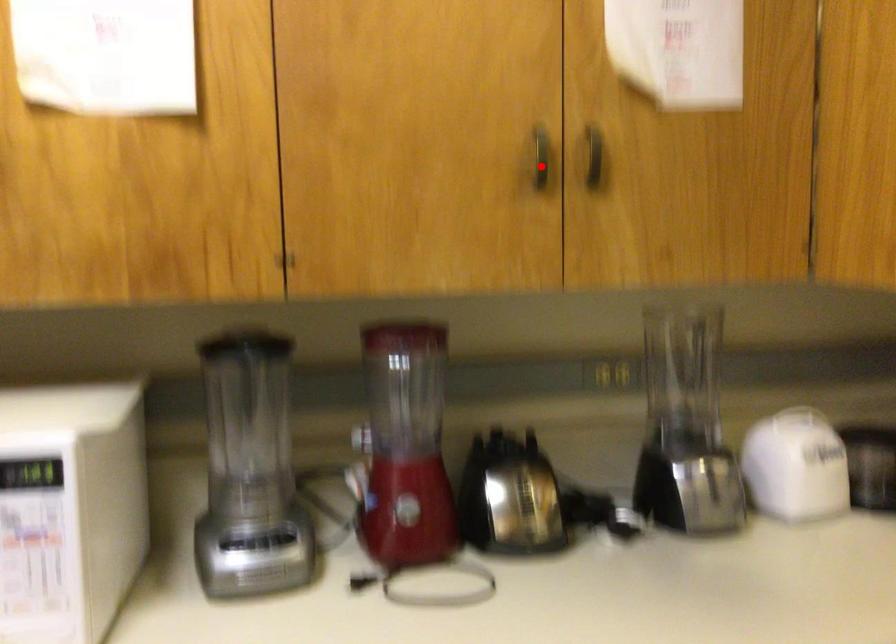
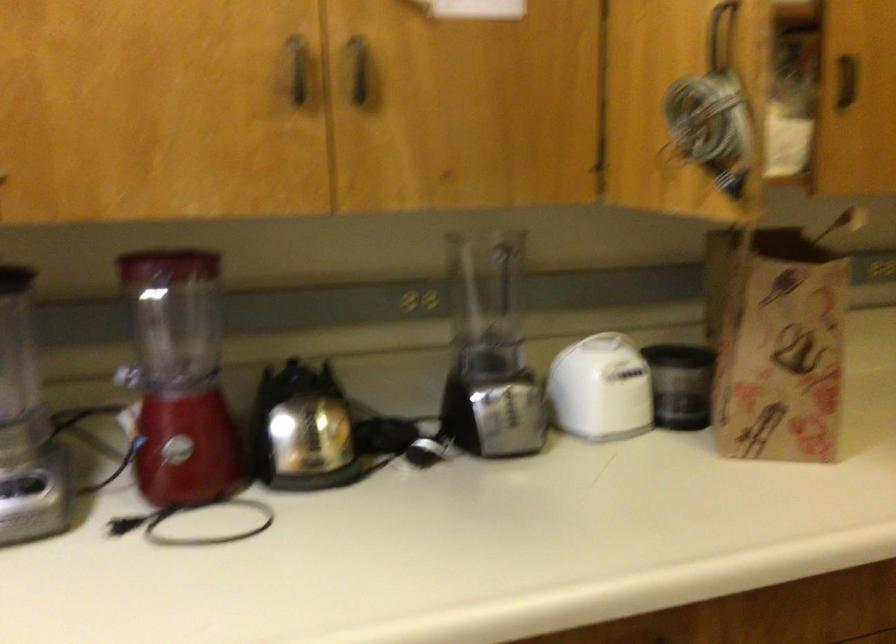
Question: I am providing you with two images of the same scene from different viewpoints. Image1 has a red point marked. In image2, the corresponding 3D location appears at what relative position? Reply with the corresponding letter.

Choices:
 (A) Closer
 (B) Farther

Answer: (A)